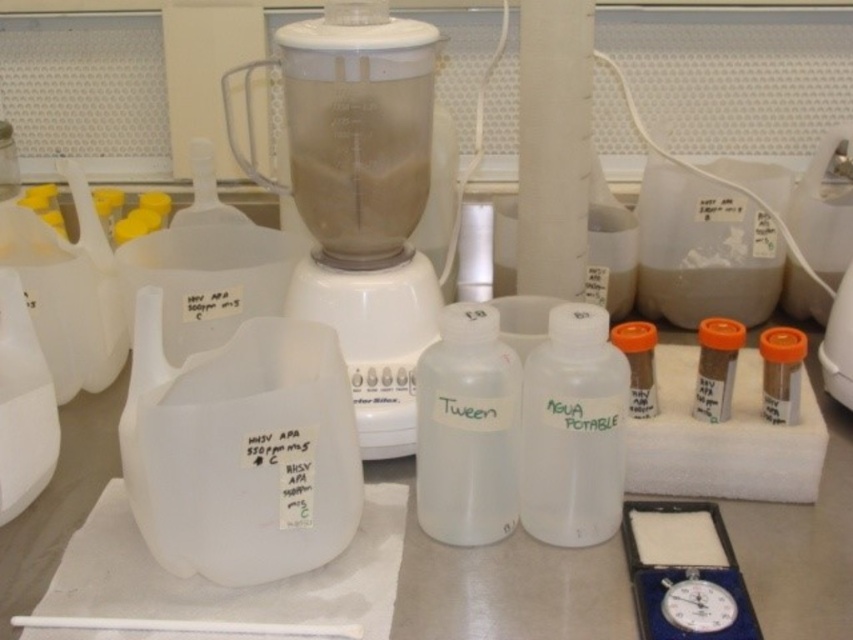
Who is lower down, transparent plastic bottle at center or brown matte vial at center-right?

Positioned lower is transparent plastic bottle at center.

Who is shorter, transparent plastic bottle at center or brown matte vial at center-right?

brown matte vial at center-right

The width and height of the screenshot is (853, 640). What do you see at coordinates (467, 429) in the screenshot? I see `transparent plastic bottle at center` at bounding box center [467, 429].

Find the location of a particular element. Image resolution: width=853 pixels, height=640 pixels. transparent plastic bottle at center is located at coordinates (467, 429).

Does white matte bottle at center have a greater width compared to transparent plastic bottle at center?

Incorrect, white matte bottle at center's width does not surpass transparent plastic bottle at center's.

The height and width of the screenshot is (640, 853). Describe the element at coordinates (573, 429) in the screenshot. I see `white matte bottle at center` at that location.

Between point (590, 433) and point (483, 333), which one is positioned behind?

Point (590, 433)

Find the location of a particular element. Image resolution: width=853 pixels, height=640 pixels. white matte bottle at center is located at coordinates (573, 429).

Where is `white plastic blender at center`? The image size is (853, 640). white plastic blender at center is located at coordinates (360, 196).

Between point (369, 129) and point (561, 355), which one is positioned in front?

Point (561, 355) is more forward.

Is point (415, 266) positioned before point (608, 499)?

No, (415, 266) is further to viewer.

You are a GUI agent. You are given a task and a screenshot of the screen. Output one action in this format:
    pyautogui.click(x=<x>, y=<y>)
    Task: Click on the white plastic blender at center
    This screenshot has height=640, width=853.
    Given the screenshot: What is the action you would take?
    pyautogui.click(x=360, y=196)